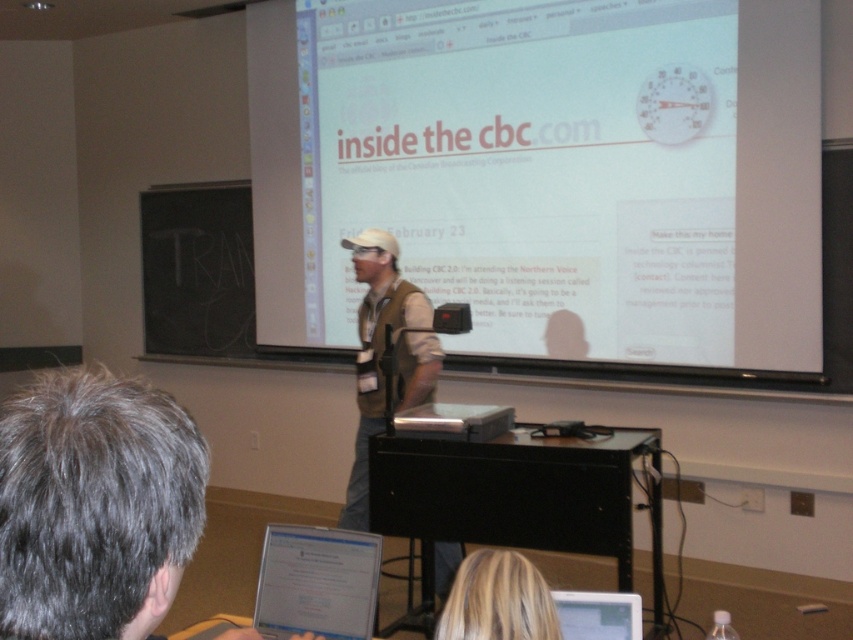
Does point (292, 572) lie in front of point (579, 600)?

No.

Can you confirm if white glossy tablet at lower center is positioned above silver metallic laptop at lower center?

Actually, white glossy tablet at lower center is below silver metallic laptop at lower center.

Measure the distance between point (349, 624) and camera.

Point (349, 624) is 5.38 feet from camera.

Identify the location of white glossy tablet at lower center. This screenshot has width=853, height=640. (316, 582).

Can you confirm if blonde hair at lower center is shorter than silver metallic laptop at lower center?

Yes.

Does blonde hair at lower center have a greater width compared to silver metallic laptop at lower center?

No.

At what (x,y) coordinates should I click in order to perform the action: click on blonde hair at lower center. Please return your answer as a coordinate pair (x, y). The height and width of the screenshot is (640, 853). Looking at the image, I should click on (497, 600).

Locate an element on the screen. The height and width of the screenshot is (640, 853). blonde hair at lower center is located at coordinates (497, 600).

Who is positioned more to the left, white glossy tablet at lower center or blonde hair at lower center?

white glossy tablet at lower center is more to the left.

Measure the distance between white glossy tablet at lower center and blonde hair at lower center.

They are 63.76 centimeters apart.

Which is behind, point (306, 596) or point (503, 593)?

The point (306, 596) is behind.

Image resolution: width=853 pixels, height=640 pixels. Identify the location of white glossy tablet at lower center. (316, 582).